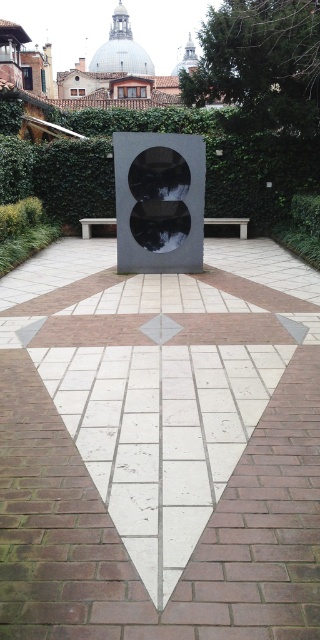
Question: Which of the following is the farthest from the observer?

Choices:
 (A) wooden bench at center
 (B) smooth gray bench at center
 (C) white brick path at center

Answer: (B)

Question: Where is white brick path at center located in relation to light gray wooden bench at center in the image?

Choices:
 (A) right
 (B) left

Answer: (B)

Question: Which object is positioned farthest from the polished black stone sculpture at center?

Choices:
 (A) smooth gray bench at center
 (B) white brick path at center
 (C) wooden bench at center

Answer: (A)

Question: Which point is farther to the camera?

Choices:
 (A) wooden bench at center
 (B) polished black stone sculpture at center

Answer: (A)

Question: Considering the relative positions of white brick path at center and wooden bench at center in the image provided, where is white brick path at center located with respect to wooden bench at center?

Choices:
 (A) right
 (B) left

Answer: (B)

Question: Considering the relative positions of wooden bench at center and smooth gray bench at center in the image provided, where is wooden bench at center located with respect to smooth gray bench at center?

Choices:
 (A) below
 (B) above

Answer: (B)